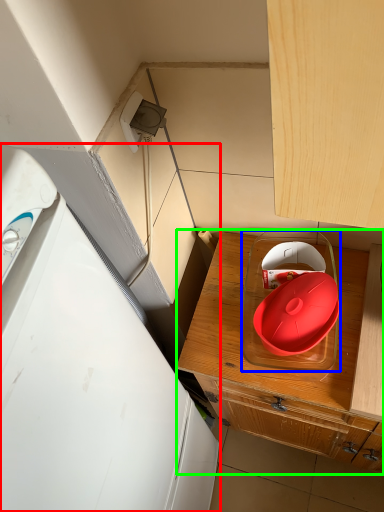
Question: Based on their relative distances, which object is farther from home appliance (highlighted by a red box)? Choose from appliance (highlighted by a blue box) and cabinetry (highlighted by a green box).

Choices:
 (A) appliance
 (B) cabinetry

Answer: (A)